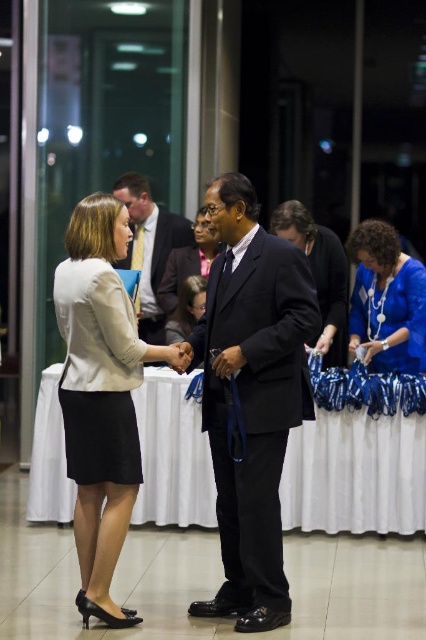
You are an event photographer at the conference. You need to capture a photo of both the matte beige blazer at center and the dark blue suit at center in the same frame. Which clothing item will appear taller in the photograph?

The matte beige blazer at center will appear taller in the photograph since it has a greater height compared to the dark blue suit at center according to the description.

You are attending a formal event and notice a specific point in the image. Can you identify what object is located at the coordinates point (100, 394)?

The point (100, 394) corresponds to the matte beige blazer at center.